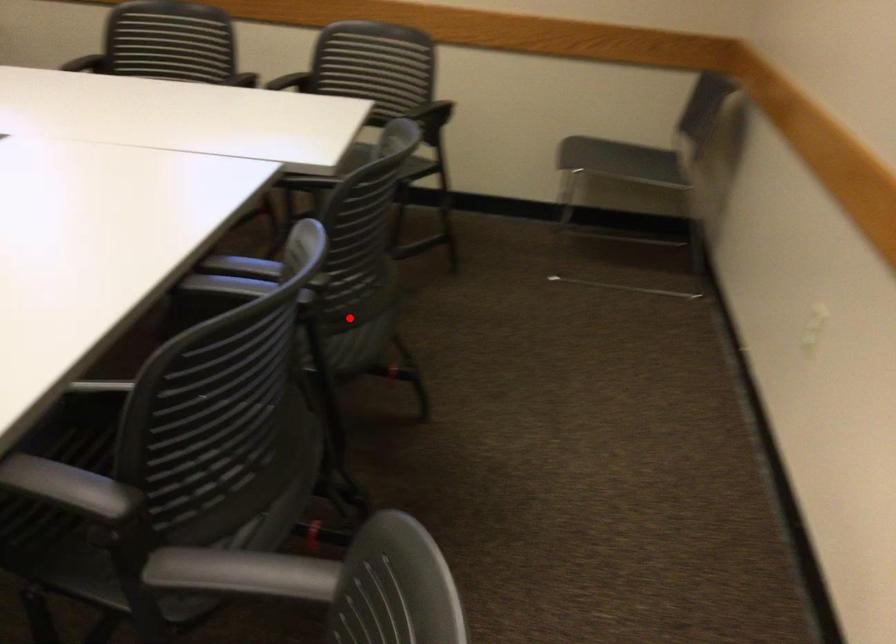
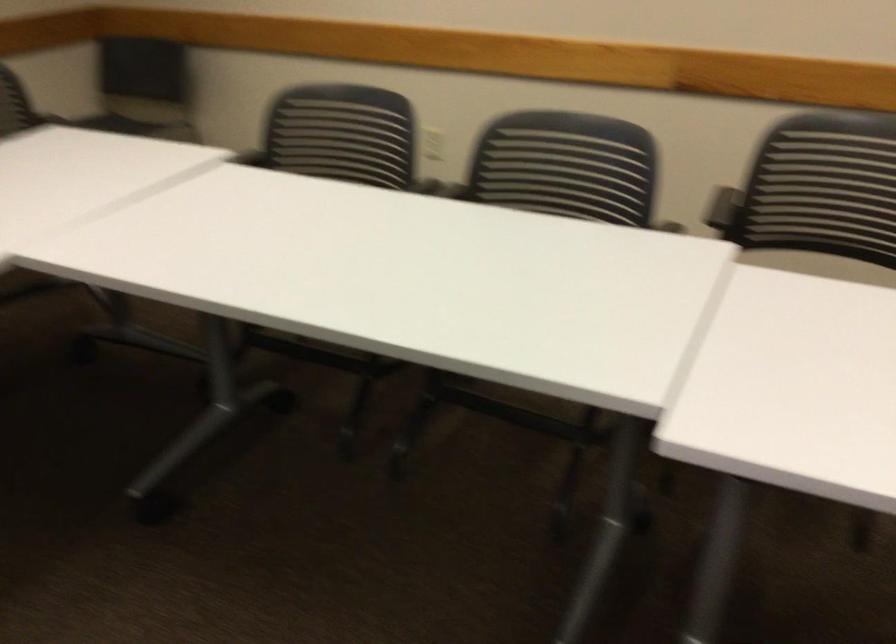
Question: I am providing you with two images of the same scene from different viewpoints. A red point is marked on the first image. At the location where the point appears in image 1, is it still visible in image 2?

Choices:
 (A) Yes
 (B) No

Answer: (B)